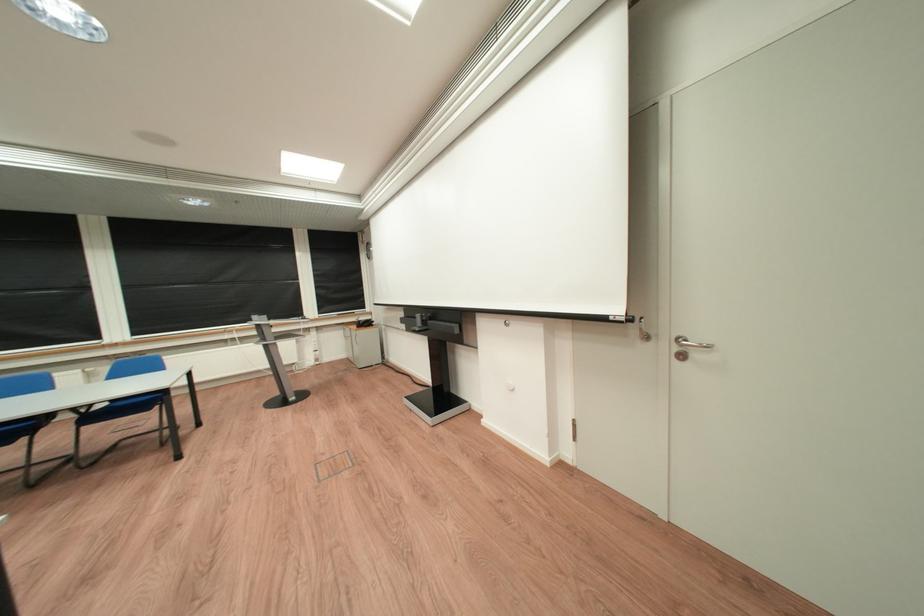
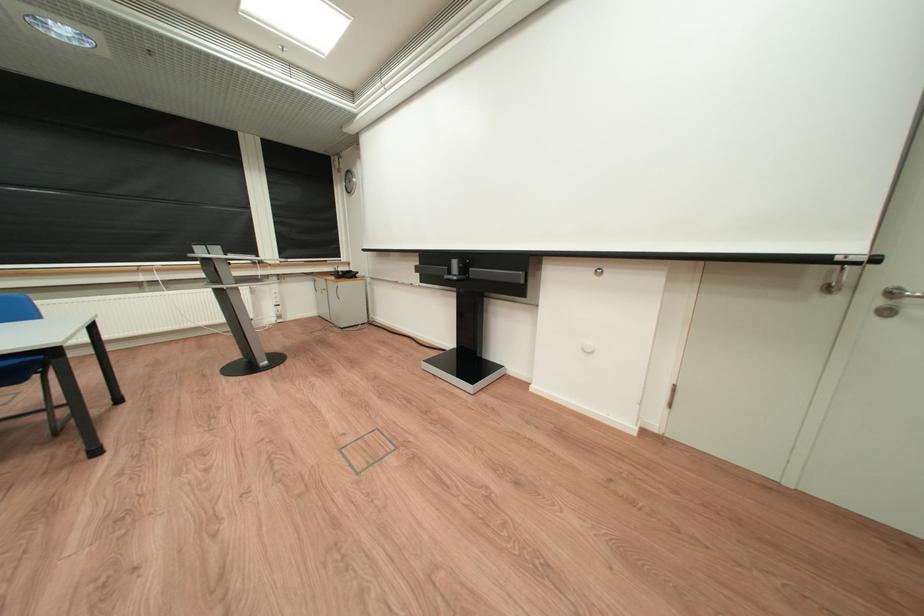
What movement of the cameraman would produce the second image?

The movement direction of the cameraman is left, forward.